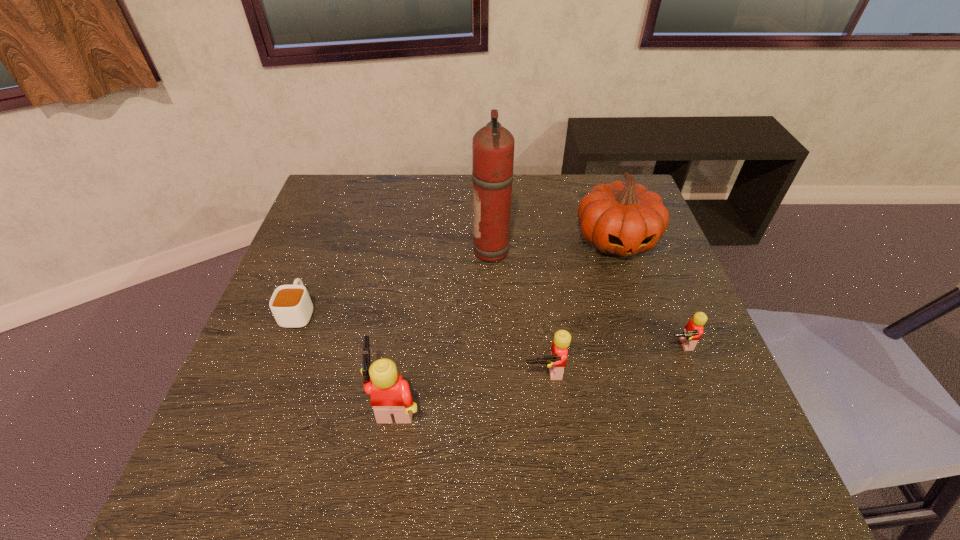
At what (x,y) coordinates should I click in order to perform the action: click on the fifth object from right to left. Please return your answer as a coordinate pair (x, y). Looking at the image, I should click on (390, 395).

You are a GUI agent. You are given a task and a screenshot of the screen. Output one action in this format:
    pyautogui.click(x=<x>, y=<y>)
    Task: Click on the tallest Lego
    This screenshot has width=960, height=540.
    Given the screenshot: What is the action you would take?
    pyautogui.click(x=390, y=395)

Where is `the fourth tallest object`? Image resolution: width=960 pixels, height=540 pixels. the fourth tallest object is located at coordinates (556, 362).

This screenshot has width=960, height=540. What are the coordinates of `the second shortest Lego` in the screenshot? It's located at (556, 362).

Identify the location of the second shortest object. (693, 330).

At what (x,y) coordinates should I click in order to perform the action: click on the rightmost Lego. Please return your answer as a coordinate pair (x, y). This screenshot has width=960, height=540. Looking at the image, I should click on (693, 330).

The width and height of the screenshot is (960, 540). Find the location of `pumpkin`. pumpkin is located at coordinates (623, 218).

At what (x,y) coordinates should I click in order to perform the action: click on the tallest object. Please return your answer as a coordinate pair (x, y). Looking at the image, I should click on (493, 145).

In order to click on the leftmost object in this screenshot , I will do `click(291, 305)`.

This screenshot has width=960, height=540. In order to click on the shortest object in this screenshot , I will do [x=291, y=305].